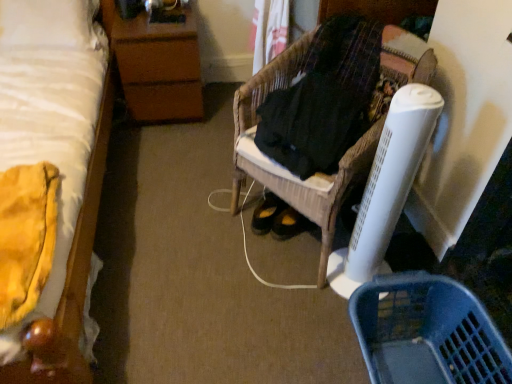
Question: Is brown wood nightstand at upper left positioned in front of woven wood chair at center?

Choices:
 (A) no
 (B) yes

Answer: (A)

Question: Can you confirm if brown wood nightstand at upper left is shorter than woven wood chair at center?

Choices:
 (A) yes
 (B) no

Answer: (A)

Question: Does brown wood nightstand at upper left have a greater height compared to woven wood chair at center?

Choices:
 (A) yes
 (B) no

Answer: (B)

Question: From the image's perspective, is brown wood nightstand at upper left under woven wood chair at center?

Choices:
 (A) yes
 (B) no

Answer: (B)

Question: From a real-world perspective, is brown wood nightstand at upper left physically above woven wood chair at center?

Choices:
 (A) yes
 (B) no

Answer: (B)

Question: In terms of width, does woven wood chair at center look wider or thinner when compared to brown wood nightstand at upper left?

Choices:
 (A) wide
 (B) thin

Answer: (A)

Question: Considering the relative positions of woven wood chair at center and brown wood nightstand at upper left in the image provided, is woven wood chair at center to the left or to the right of brown wood nightstand at upper left?

Choices:
 (A) right
 (B) left

Answer: (A)

Question: In terms of height, does woven wood chair at center look taller or shorter compared to brown wood nightstand at upper left?

Choices:
 (A) tall
 (B) short

Answer: (A)

Question: Considering the positions of woven wood chair at center and brown wood nightstand at upper left in the image, is woven wood chair at center bigger or smaller than brown wood nightstand at upper left?

Choices:
 (A) small
 (B) big

Answer: (B)

Question: In terms of size, does black woven fabric at center appear bigger or smaller than woven wood chair at center?

Choices:
 (A) big
 (B) small

Answer: (B)

Question: From their relative heights in the image, would you say black woven fabric at center is taller or shorter than woven wood chair at center?

Choices:
 (A) tall
 (B) short

Answer: (B)

Question: Is point (333, 89) closer or farther from the camera than point (373, 109)?

Choices:
 (A) farther
 (B) closer

Answer: (B)

Question: Is black woven fabric at center inside the boundaries of woven wood chair at center, or outside?

Choices:
 (A) inside
 (B) outside

Answer: (A)

Question: From a real-world perspective, relative to black woven fabric at center, is blue plastic basket at lower right vertically above or below?

Choices:
 (A) below
 (B) above

Answer: (A)

Question: Considering the relative positions of blue plastic basket at lower right and black woven fabric at center in the image provided, is blue plastic basket at lower right to the left or to the right of black woven fabric at center?

Choices:
 (A) right
 (B) left

Answer: (A)